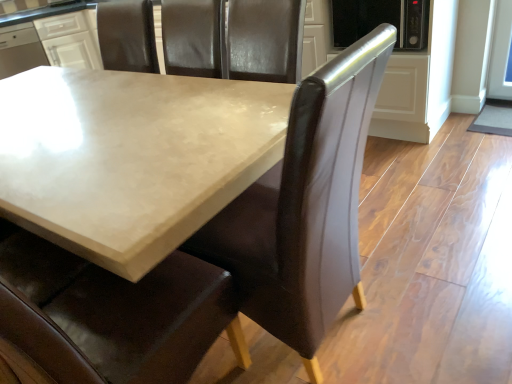
Question: Is white glossy cabinet at upper left wider or thinner than brown leather chair at center?

Choices:
 (A) thin
 (B) wide

Answer: (B)

Question: Does point (72, 46) appear closer or farther from the camera than point (216, 241)?

Choices:
 (A) farther
 (B) closer

Answer: (A)

Question: Estimate the real-world distances between objects in this image. Which object is farther from the white glossy cabinet at upper left?

Choices:
 (A) matte concrete table at center
 (B) brown leather chair at center

Answer: (B)

Question: Which is farther from the matte concrete table at center?

Choices:
 (A) brown leather chair at center
 (B) white glossy cabinet at upper left

Answer: (B)